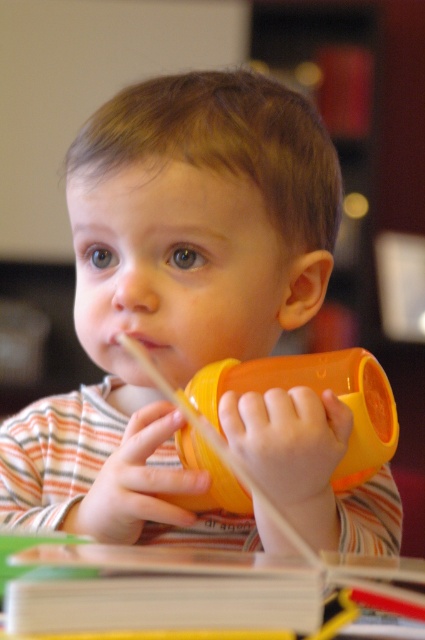
You are a photographer trying to capture the child holding both the orange plastic cup at center and the orange matte sippy cup at center. Since you want to focus on the cup the child is actively drinking from, which one should you focus on?

The orange plastic cup at center is located above the orange matte sippy cup at center, so the photographer should focus on the orange plastic cup at center since it is the one the child is likely drinking from.

You are a photographer who wants to take a closeup shot of the orange plastic cup at center. You notice there is a point at coordinates point [172,291] in the image. Is this point located on the orange plastic cup at center?

Yes, the point [172,291] is located on the orange plastic cup at center as stated in the objects description.

You are a photographer trying to capture a candid shot of the child holding the sippy cup. You notice two points in the image at coordinates point [224,355] and point [391,401]. Which point is closer to the camera?

Point [391,401] is closer to the camera since the description states that point [224,355] is behind point [391,401].